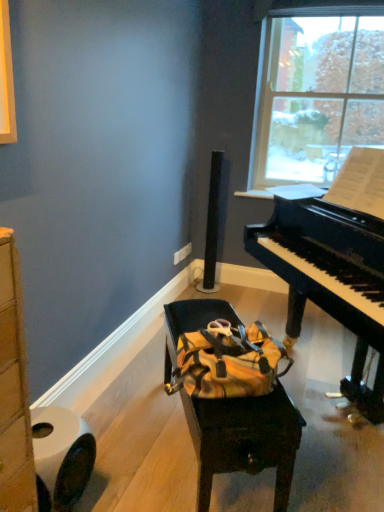
Question: Is white matte toilet paper at lower left far away from yellow fabric bag at center?

Choices:
 (A) yes
 (B) no

Answer: (B)

Question: Can you confirm if white matte toilet paper at lower left is positioned to the left of yellow fabric bag at center?

Choices:
 (A) no
 (B) yes

Answer: (B)

Question: Is the position of white matte toilet paper at lower left less distant than that of yellow fabric bag at center?

Choices:
 (A) no
 (B) yes

Answer: (B)

Question: Is white matte toilet paper at lower left looking in the opposite direction of yellow fabric bag at center?

Choices:
 (A) no
 (B) yes

Answer: (A)

Question: From the image's perspective, is white matte toilet paper at lower left on yellow fabric bag at center?

Choices:
 (A) no
 (B) yes

Answer: (A)

Question: From their relative heights in the image, would you say black polished piano at right is taller or shorter than white matte toilet paper at lower left?

Choices:
 (A) tall
 (B) short

Answer: (A)

Question: Looking at their shapes, would you say black polished piano at right is wider or thinner than white matte toilet paper at lower left?

Choices:
 (A) wide
 (B) thin

Answer: (A)

Question: Relative to white matte toilet paper at lower left, is black polished piano at right in front or behind?

Choices:
 (A) front
 (B) behind

Answer: (A)

Question: Considering the positions of black polished piano at right and white matte toilet paper at lower left in the image, is black polished piano at right bigger or smaller than white matte toilet paper at lower left?

Choices:
 (A) big
 (B) small

Answer: (A)

Question: Considering the positions of transparent glass window at upper right and yellow fabric bag at center in the image, is transparent glass window at upper right bigger or smaller than yellow fabric bag at center?

Choices:
 (A) big
 (B) small

Answer: (B)

Question: Considering the positions of transparent glass window at upper right and yellow fabric bag at center in the image, is transparent glass window at upper right wider or thinner than yellow fabric bag at center?

Choices:
 (A) thin
 (B) wide

Answer: (A)

Question: From a real-world perspective, is transparent glass window at upper right physically located above or below yellow fabric bag at center?

Choices:
 (A) below
 (B) above

Answer: (B)

Question: Considering the positions of point (311, 111) and point (288, 453), is point (311, 111) closer or farther from the camera than point (288, 453)?

Choices:
 (A) closer
 (B) farther

Answer: (B)

Question: From a real-world perspective, relative to transparent glass window at upper right, is yellow fabric bag at center vertically above or below?

Choices:
 (A) above
 (B) below

Answer: (B)

Question: Is yellow fabric bag at center in front of or behind transparent glass window at upper right in the image?

Choices:
 (A) front
 (B) behind

Answer: (A)